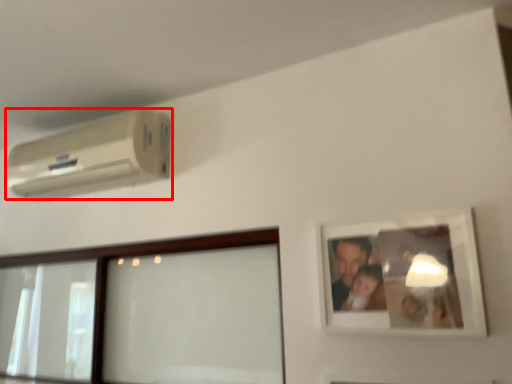
Question: Where is air conditioning (annotated by the red box) located in relation to picture frame in the image?

Choices:
 (A) left
 (B) right

Answer: (A)